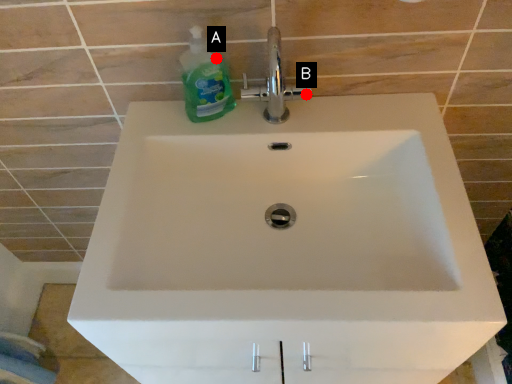
Question: Two points are circled on the image, labeled by A and B beside each circle. Which of the following is the farthest from the observer?

Choices:
 (A) A is further
 (B) B is further

Answer: (B)